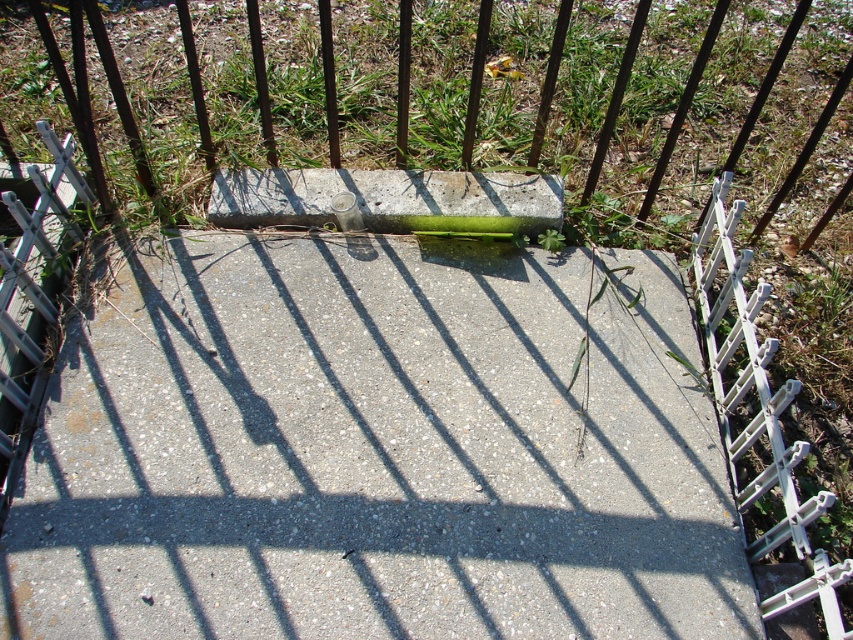
Who is more forward, (457, 44) or (236, 227)?

Point (236, 227)

Which is more to the right, green grass at center or concreteroughconcrete block at center?

green grass at center is more to the right.

This screenshot has height=640, width=853. In order to click on green grass at center in this screenshot , I will do `click(438, 99)`.

Does white plastic rail at right have a greater width compared to concreteroughconcrete block at center?

No, white plastic rail at right is not wider than concreteroughconcrete block at center.

The height and width of the screenshot is (640, 853). I want to click on white plastic rail at right, so click(x=758, y=416).

Image resolution: width=853 pixels, height=640 pixels. I want to click on white plastic rail at right, so click(x=758, y=416).

Is gray concrete at center bigger than white plastic rail at right?

Indeed, gray concrete at center has a larger size compared to white plastic rail at right.

Is point (567, 536) positioned in front of point (729, 316)?

Yes, it is in front of point (729, 316).

Which is behind, point (664, 531) or point (735, 212)?

The point (735, 212) is behind.

At what (x,y) coordinates should I click in order to perform the action: click on gray concrete at center. Please return your answer as a coordinate pair (x, y). The height and width of the screenshot is (640, 853). Looking at the image, I should click on click(375, 451).